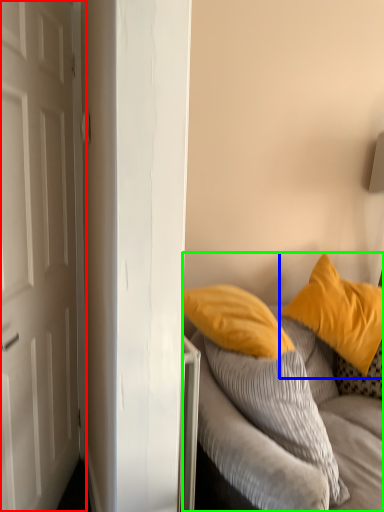
Question: Considering the real-world distances, which object is closest to door (highlighted by a red box)? pillow (highlighted by a blue box) or studio couch (highlighted by a green box).

Choices:
 (A) pillow
 (B) studio couch

Answer: (B)